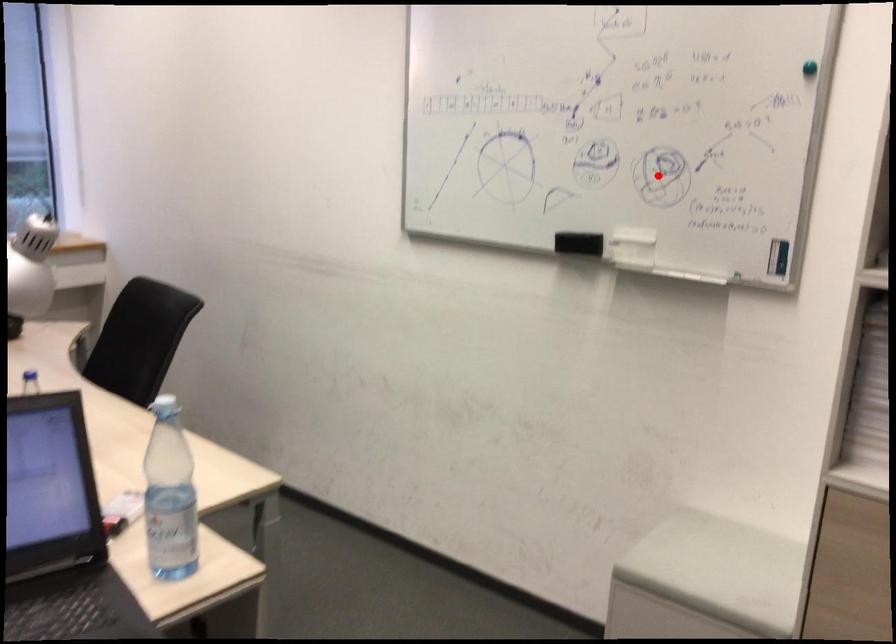
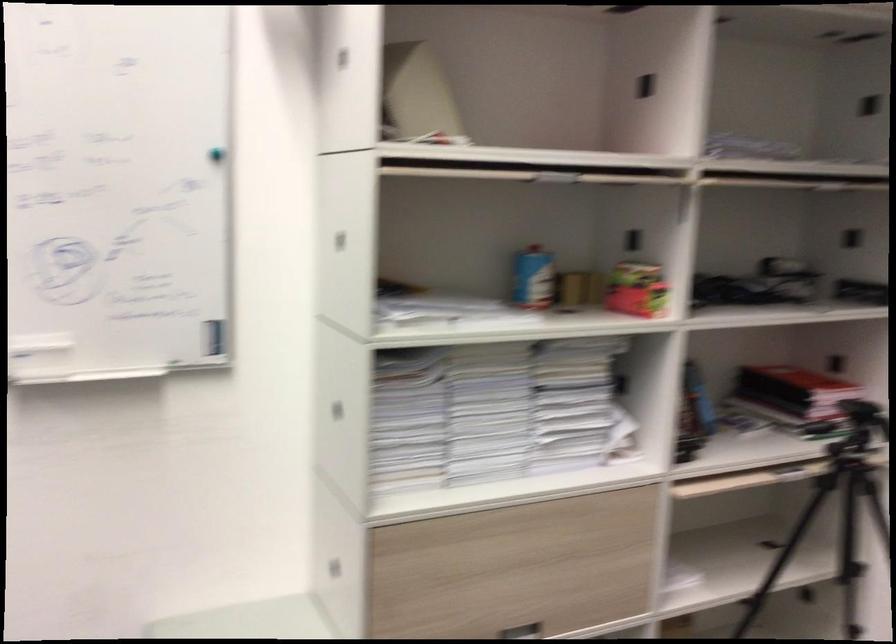
Question: I am providing you with two images of the same scene from different viewpoints. Given a red point in image1, look at the same physical point in image2. Is it:

Choices:
 (A) Closer to the viewpoint
 (B) Farther from the viewpoint

Answer: (A)